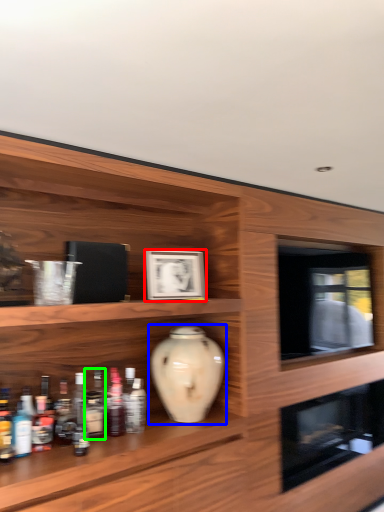
Question: Based on their relative distances, which object is farther from picture frame (highlighted by a red box)? Choose from vase (highlighted by a blue box) and bottle (highlighted by a green box).

Choices:
 (A) vase
 (B) bottle

Answer: (B)